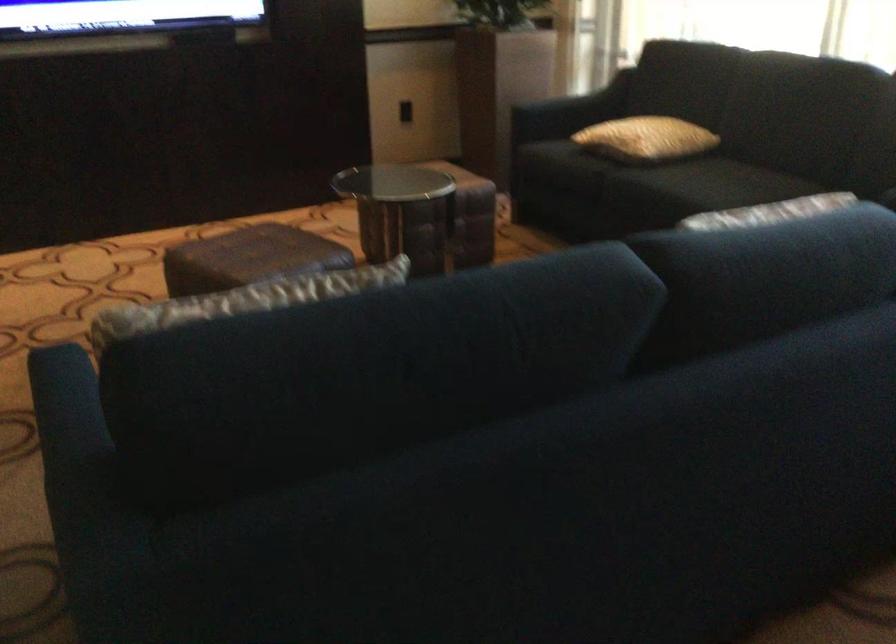
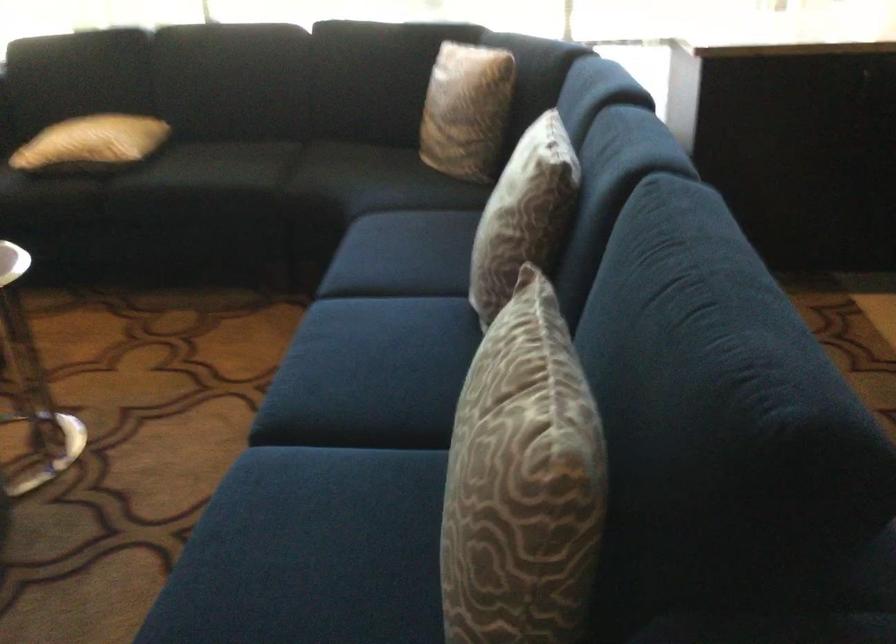
The point at (105, 337) is marked in the first image. Where is the corresponding point in the second image?

(522, 482)